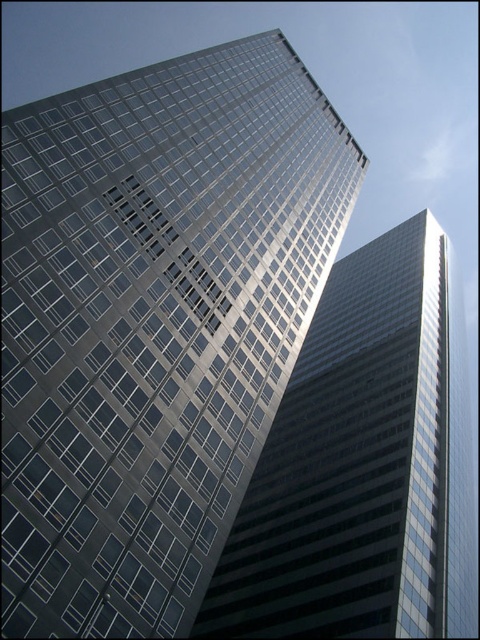
Question: Does glossy glass building at center lie in front of reflective glass skyscraper at center?

Choices:
 (A) no
 (B) yes

Answer: (B)

Question: Which object appears closest to the camera in this image?

Choices:
 (A) glossy glass building at center
 (B) reflective glass skyscraper at center

Answer: (A)

Question: Does glossy glass building at center have a lesser width compared to reflective glass skyscraper at center?

Choices:
 (A) yes
 (B) no

Answer: (A)

Question: Is glossy glass building at center further to camera compared to reflective glass skyscraper at center?

Choices:
 (A) no
 (B) yes

Answer: (A)